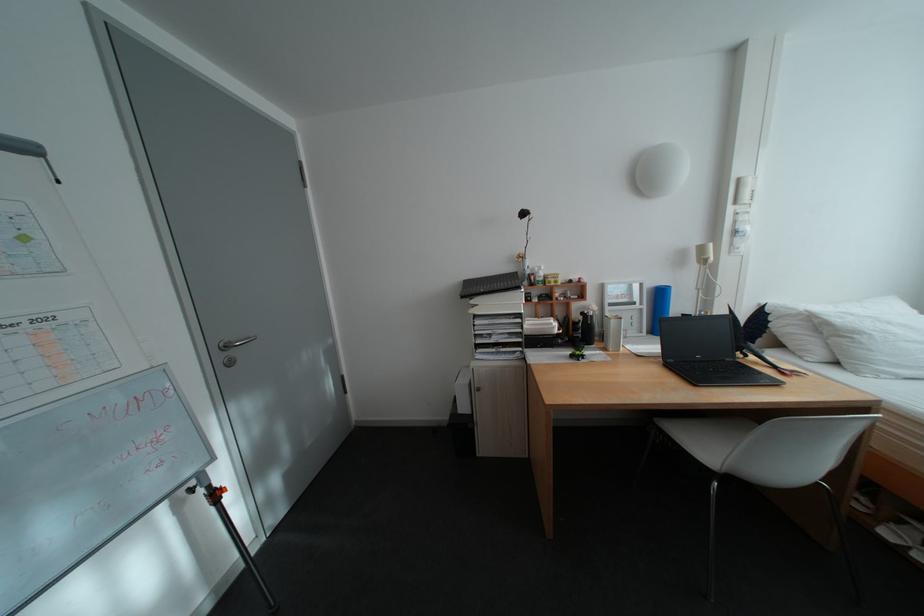
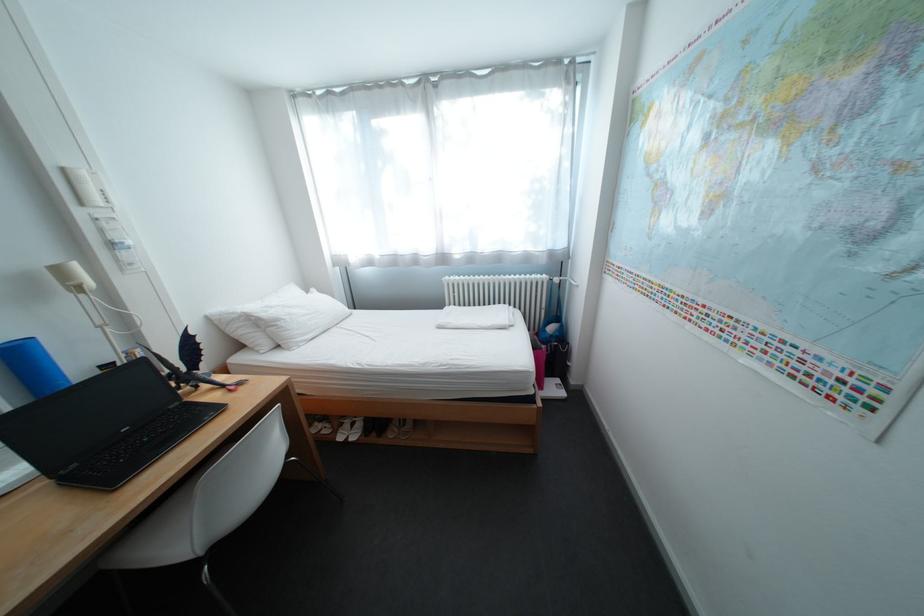
Locate, in the second image, the point that corresponds to pixel 871 334 in the first image.

(292, 322)